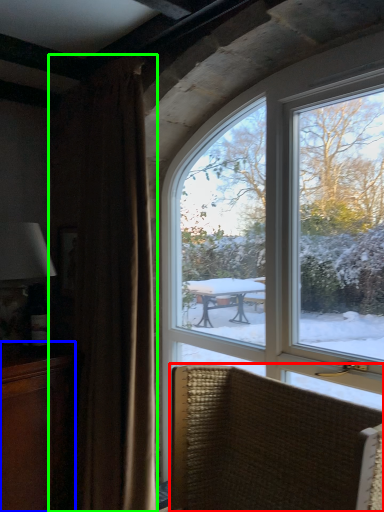
Question: Which is nearer to the chair (highlighted by a red box)? cabinetry (highlighted by a blue box) or curtain (highlighted by a green box).

Choices:
 (A) cabinetry
 (B) curtain

Answer: (B)